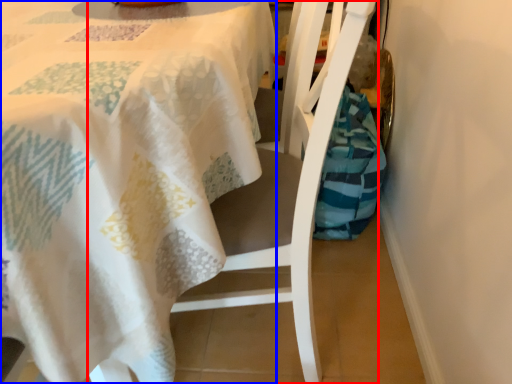
Question: Which object is further to the camera taking this photo, chair (highlighted by a red box) or tablecloth (highlighted by a blue box)?

Choices:
 (A) chair
 (B) tablecloth

Answer: (A)